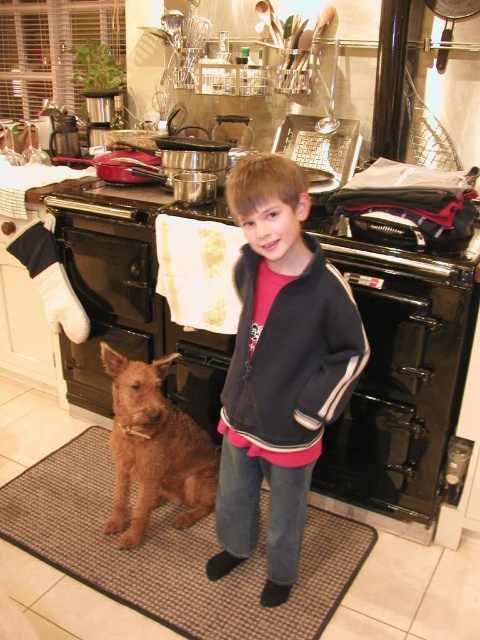
Question: Among these points, which one is nearest to the camera?

Choices:
 (A) (151, 586)
 (B) (49, 310)
 (C) (296, 412)
 (D) (194, 476)

Answer: (C)

Question: Estimate the real-world distances between objects in this image. Which object is closer to the shaggy brown dog at lower left?

Choices:
 (A) black fleece jacket at center
 (B) dark blue fleece sweatshirt at center
 (C) brown textured mat at center

Answer: (C)

Question: Which of the following is the farthest from the observer?

Choices:
 (A) (364, 456)
 (B) (213, 625)
 (C) (297, 216)

Answer: (A)

Question: In this image, where is black matte oven at center located relative to black fabric oven mitt at left?

Choices:
 (A) above
 (B) below

Answer: (B)

Question: Can you confirm if black matte oven at center is positioned to the right of dark blue fleece sweatshirt at center?

Choices:
 (A) yes
 (B) no

Answer: (B)

Question: Is black fleece jacket at center above dark blue fleece sweatshirt at center?

Choices:
 (A) yes
 (B) no

Answer: (B)